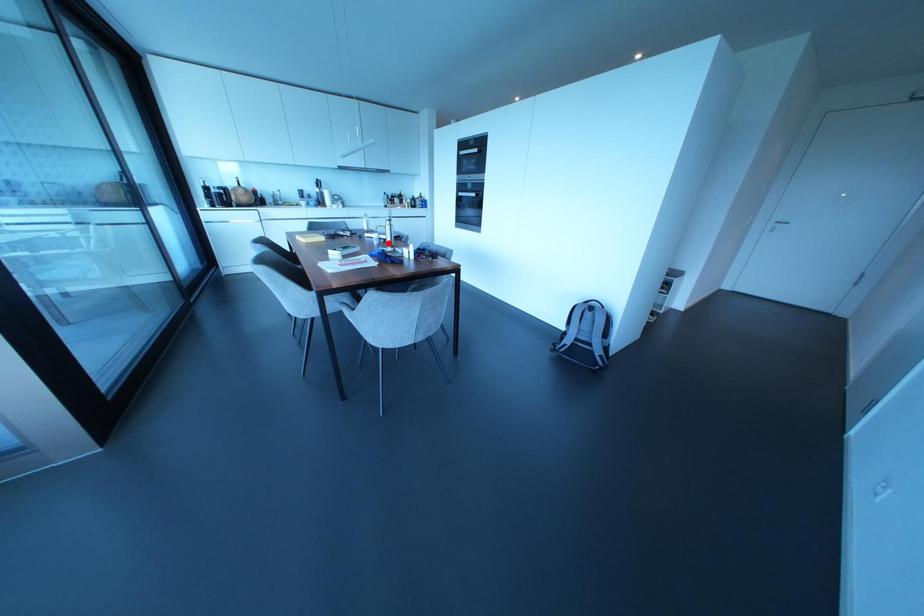
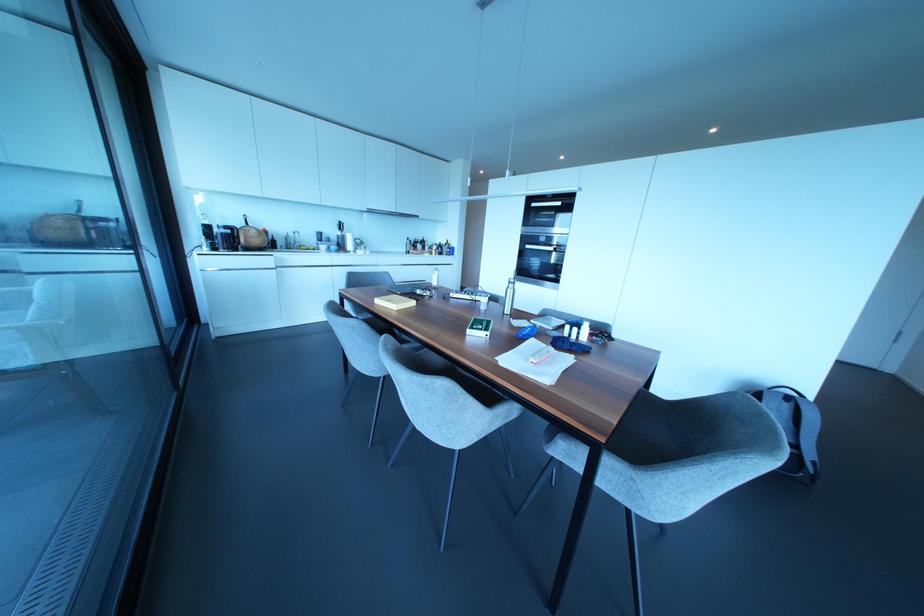
Locate, in the second image, the point that corresponds to the highlighted location in the first image.

(506, 310)